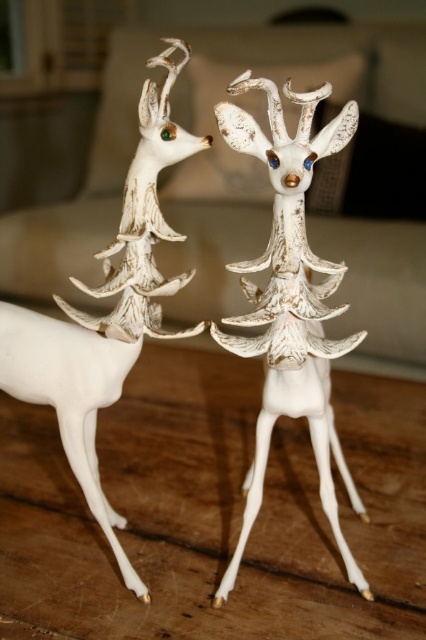
Between point (313, 408) and point (23, 385), which one is positioned behind?

Point (313, 408)

Between white matte deer at center and white porcelain deer at center, which one is positioned higher?

white porcelain deer at center is above.

Which is in front, point (302, 131) or point (134, 212)?

Point (302, 131)

Identify the location of white matte deer at center. (290, 301).